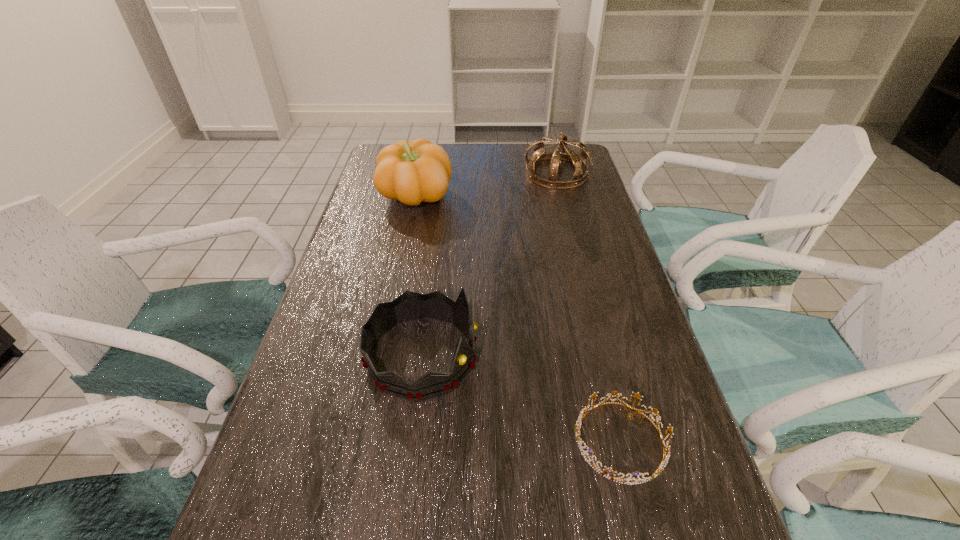
Locate an element on the screen. The height and width of the screenshot is (540, 960). empty space between the shortest object and the leftmost tiara is located at coordinates (521, 398).

I want to click on unoccupied area between the farthest tiara and the pumpkin, so click(486, 185).

At what (x,y) coordinates should I click in order to perform the action: click on free area in between the shortest object and the leftmost tiara. Please return your answer as a coordinate pair (x, y). Looking at the image, I should click on (521, 398).

What are the coordinates of `vacant area that lies between the shortest object and the pumpkin` in the screenshot? It's located at (517, 319).

I want to click on unoccupied position between the shortest tiara and the farthest tiara, so click(x=588, y=307).

This screenshot has width=960, height=540. What are the coordinates of `free area in between the pumpkin and the shortest tiara` in the screenshot? It's located at (517, 319).

In order to click on free space between the pumpkin and the shortest object in this screenshot , I will do `click(517, 319)`.

You are a GUI agent. You are given a task and a screenshot of the screen. Output one action in this format:
    pyautogui.click(x=<x>, y=<y>)
    Task: Click on the object that stands as the closest to the leftmost tiara
    
    Given the screenshot: What is the action you would take?
    pyautogui.click(x=659, y=470)

Select which object appears as the second closest to the leftmost tiara. Please provide its 2D coordinates. Your answer should be formatted as a tuple, i.e. [(x, y)], where the tuple contains the x and y coordinates of a point satisfying the conditions above.

[(412, 172)]

The width and height of the screenshot is (960, 540). Find the location of `the second closest tiara to the shortest object`. the second closest tiara to the shortest object is located at coordinates (579, 161).